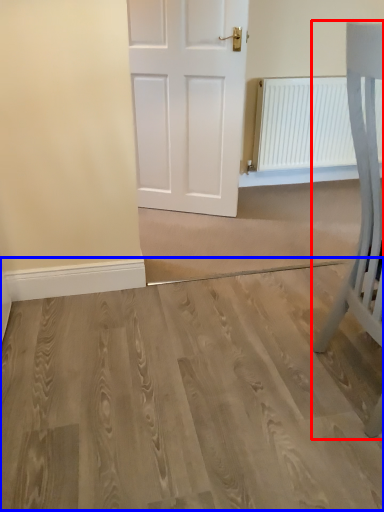
Question: Which object appears closest to the camera in this image, furniture (highlighted by a red box) or plain (highlighted by a blue box)?

Choices:
 (A) furniture
 (B) plain

Answer: (A)